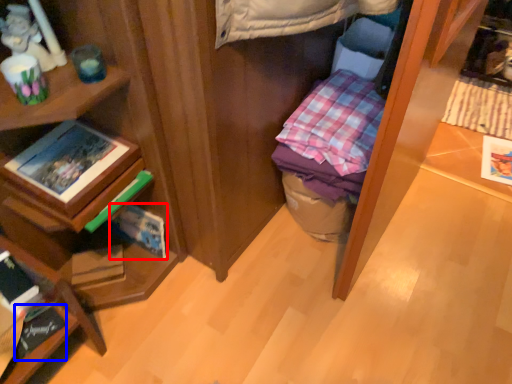
Question: Among these objects, which one is farthest to the camera, paperback book (highlighted by a red box) or book (highlighted by a blue box)?

Choices:
 (A) paperback book
 (B) book

Answer: (A)